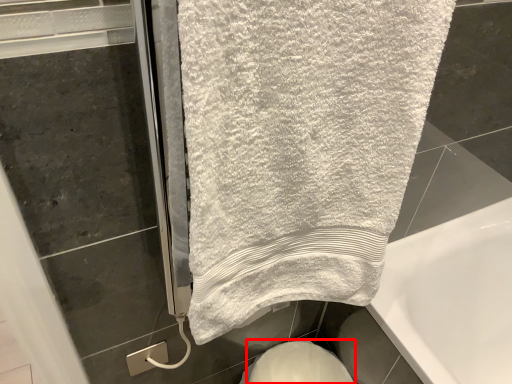
Question: In this image, where is bidet (annotated by the red box) located relative to towel?

Choices:
 (A) right
 (B) left

Answer: (A)